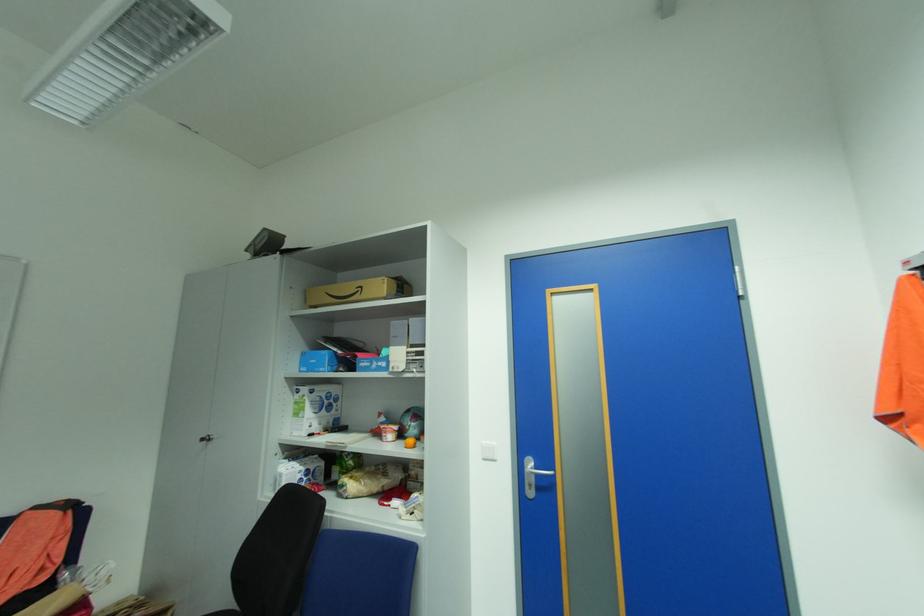
The location [387,432] corresponds to which object?

It refers to a red plastic cup.